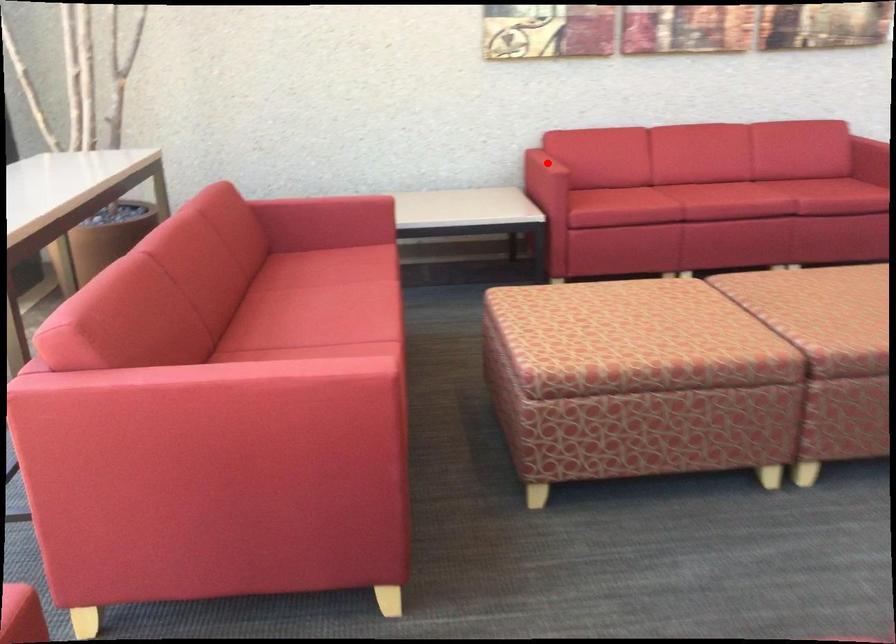
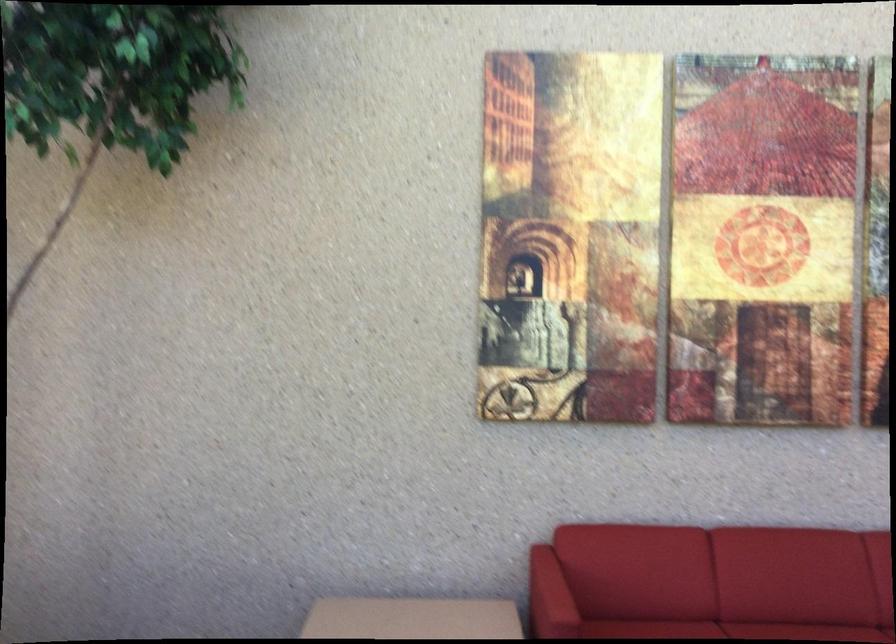
Question: I am providing you with two images of the same scene from different viewpoints. Image1 has a red point marked. In image2, the corresponding 3D location appears at what relative position? Reply with the corresponding letter.

Choices:
 (A) Closer
 (B) Farther

Answer: (A)